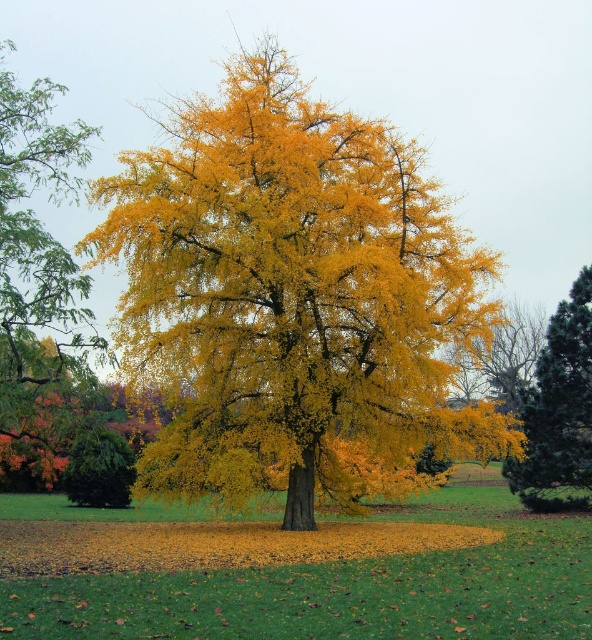
Who is shorter, shiny dark green pine tree at right or yellow matte tree at center?

With less height is yellow matte tree at center.

Image resolution: width=592 pixels, height=640 pixels. What do you see at coordinates (558, 410) in the screenshot?
I see `shiny dark green pine tree at right` at bounding box center [558, 410].

Is point (538, 499) behind point (481, 387)?

No, it is not.

The width and height of the screenshot is (592, 640). In order to click on shiny dark green pine tree at right in this screenshot , I will do `click(558, 410)`.

Between yellow leafy tree at center and yellow matte tree at center, which one is positioned lower?

yellow matte tree at center is lower down.

Is yellow leafy tree at center shorter than yellow matte tree at center?

No.

At what (x,y) coordinates should I click in order to perform the action: click on yellow leafy tree at center. Please return your answer as a coordinate pair (x, y). Looking at the image, I should click on pos(296,300).

Is yellow leafy tree at center smaller than shiny dark green pine tree at right?

No, yellow leafy tree at center is not smaller than shiny dark green pine tree at right.

Does yellow leafy tree at center have a greater width compared to shiny dark green pine tree at right?

Yes.

Find the location of a particular element. The width and height of the screenshot is (592, 640). yellow leafy tree at center is located at coordinates (296, 300).

This screenshot has width=592, height=640. In order to click on yellow leafy tree at center in this screenshot , I will do `click(296, 300)`.